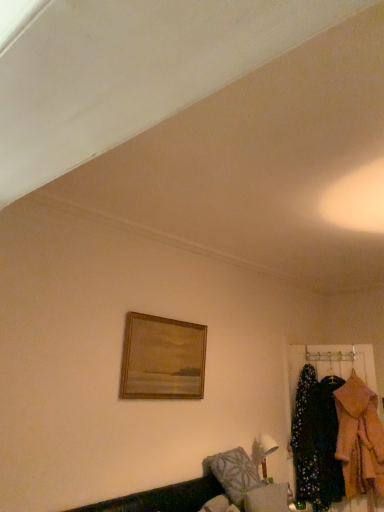
Describe the element at coordinates (163, 498) in the screenshot. I see `velvet green couch at lower right` at that location.

Locate an element on the screen. The width and height of the screenshot is (384, 512). fluffy pink coat at right is located at coordinates (359, 439).

Is fluffy gray pillow at lower center inside or outside of wooden framed painting at upper center?

fluffy gray pillow at lower center is outside wooden framed painting at upper center.

Where is `picture frame located on the left of fluffy gray pillow at lower center`? Image resolution: width=384 pixels, height=512 pixels. picture frame located on the left of fluffy gray pillow at lower center is located at coordinates (162, 358).

From a real-world perspective, who is located higher, fluffy gray pillow at lower center or wooden framed painting at upper center?

From a 3D spatial view, wooden framed painting at upper center is above.

From a real-world perspective, is wooden framed painting at upper center below fluffy gray pillow at lower center?

Incorrect, from a real-world perspective, wooden framed painting at upper center is higher than fluffy gray pillow at lower center.

This screenshot has width=384, height=512. I want to click on picture frame on the left of fluffy gray pillow at lower center, so click(x=162, y=358).

In terms of height, does wooden framed painting at upper center look taller or shorter compared to fluffy gray pillow at lower center?

Considering their sizes, wooden framed painting at upper center has less height than fluffy gray pillow at lower center.

Measure the distance between fluffy pink coat at right and fluffy gray pillow at lower center.

The distance of fluffy pink coat at right from fluffy gray pillow at lower center is 4.11 feet.

Identify the location of pillow beneath the fluffy pink coat at right (from a real-world perspective). (233, 473).

Does fluffy pink coat at right have a greater width compared to fluffy gray pillow at lower center?

Incorrect, the width of fluffy pink coat at right does not surpass that of fluffy gray pillow at lower center.

Are fluffy gray pillow at lower center and fluffy pink coat at right far apart?

Absolutely, fluffy gray pillow at lower center is distant from fluffy pink coat at right.

Is fluffy gray pillow at lower center facing towards fluffy pink coat at right?

No, fluffy gray pillow at lower center is not facing towards fluffy pink coat at right.

Where is `pillow on the left of fluffy pink coat at right`? The width and height of the screenshot is (384, 512). pillow on the left of fluffy pink coat at right is located at coordinates (233, 473).

What's the angular difference between fluffy gray pillow at lower center and fluffy pink coat at right's facing directions?

The angular difference between fluffy gray pillow at lower center and fluffy pink coat at right is 75.1 degrees.

Is fluffy gray pillow at lower center in front of or behind velvet green couch at lower right in the image?

Clearly, fluffy gray pillow at lower center is behind velvet green couch at lower right.

In order to click on pillow above the velvet green couch at lower right (from a real-world perspective) in this screenshot , I will do [233, 473].

Considering the sizes of objects fluffy gray pillow at lower center and velvet green couch at lower right in the image provided, who is taller, fluffy gray pillow at lower center or velvet green couch at lower right?

fluffy gray pillow at lower center is taller.

Does fluffy gray pillow at lower center turn towards velvet green couch at lower right?

Yes, fluffy gray pillow at lower center faces towards velvet green couch at lower right.

From the image's perspective, which one is positioned lower, velvet green couch at lower right or fluffy gray pillow at lower center?

fluffy gray pillow at lower center is shown below in the image.

Which of these two, velvet green couch at lower right or fluffy gray pillow at lower center, is bigger?

Bigger between the two is velvet green couch at lower right.

Does point (115, 509) come farther from viewer compared to point (216, 469)?

No.

Is velvet green couch at lower right shorter than fluffy gray pillow at lower center?

Yes.

Which is in front, point (347, 368) or point (374, 450)?

The point (374, 450) is in front.

Does floral fabric coat at right have a smaller size compared to fluffy pink coat at right?

Indeed, floral fabric coat at right has a smaller size compared to fluffy pink coat at right.

Is floral fabric coat at right turned away from fluffy pink coat at right?

Yes, fluffy pink coat at right is at the back of floral fabric coat at right.

Find the location of `picture frame lying in front of the fluffy gray pillow at lower center`. picture frame lying in front of the fluffy gray pillow at lower center is located at coordinates (162, 358).

Find the location of `pillow behind the wooden framed painting at upper center`. pillow behind the wooden framed painting at upper center is located at coordinates (233, 473).

Based on the photo, from the image, which object appears to be farther from fluffy pink coat at right, wooden framed painting at upper center or velvet green couch at lower right?

The object further to fluffy pink coat at right is wooden framed painting at upper center.

Considering their positions, is wooden framed painting at upper center positioned further to velvet green couch at lower right than floral fabric coat at right?

The object further to velvet green couch at lower right is floral fabric coat at right.

Estimate the real-world distances between objects in this image. Which object is further from fluffy gray pillow at lower center, fluffy pink coat at right or wooden framed painting at upper center?

fluffy pink coat at right.

When comparing their distances from wooden framed painting at upper center, does velvet green couch at lower right or floral fabric coat at right seem further?

floral fabric coat at right.

From the image, which object appears to be nearer to wooden framed painting at upper center, velvet green couch at lower right or fluffy pink coat at right?

The object closer to wooden framed painting at upper center is velvet green couch at lower right.

Estimate the real-world distances between objects in this image. Which object is further from floral fabric coat at right, fluffy gray pillow at lower center or wooden framed painting at upper center?

wooden framed painting at upper center is positioned further to the anchor floral fabric coat at right.

Considering their positions, is floral fabric coat at right positioned closer to fluffy pink coat at right than fluffy gray pillow at lower center?

floral fabric coat at right is positioned closer to the anchor fluffy pink coat at right.

Estimate the real-world distances between objects in this image. Which object is further from wooden framed painting at upper center, velvet green couch at lower right or fluffy gray pillow at lower center?

fluffy gray pillow at lower center is positioned further to the anchor wooden framed painting at upper center.

Where is `picture frame between velvet green couch at lower right and fluffy gray pillow at lower center from front to back`? picture frame between velvet green couch at lower right and fluffy gray pillow at lower center from front to back is located at coordinates [162, 358].

Find the location of `closet between wooden framed painting at upper center and fluffy pink coat at right from left to right`. closet between wooden framed painting at upper center and fluffy pink coat at right from left to right is located at coordinates (331, 362).

The width and height of the screenshot is (384, 512). Identify the location of pillow between velvet green couch at lower right and fluffy pink coat at right from front to back. (233, 473).

The width and height of the screenshot is (384, 512). Find the location of `clothing between velvet green couch at lower right and floral fabric coat at right from front to back`. clothing between velvet green couch at lower right and floral fabric coat at right from front to back is located at coordinates (359, 439).